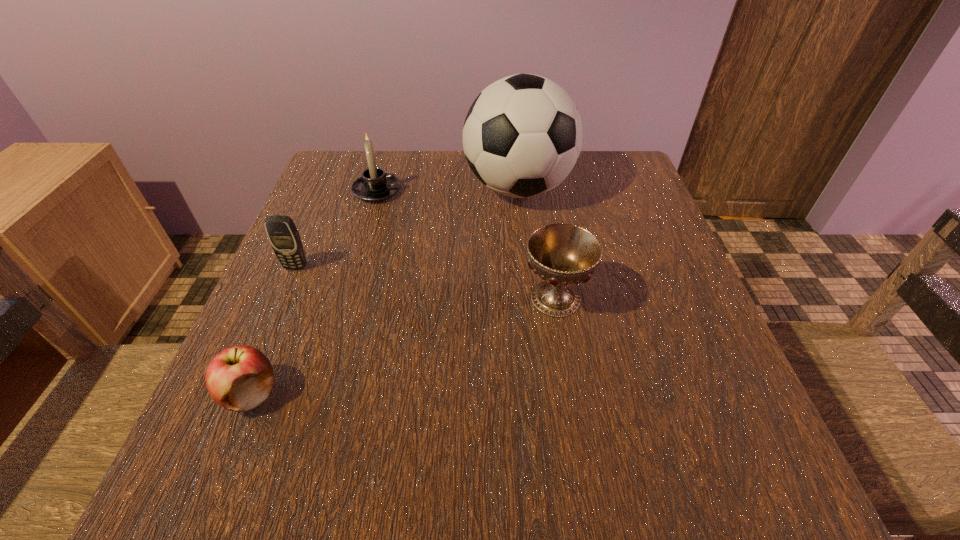
Identify the location of free space located 0.320m on the front face of the cellular telephone. This screenshot has height=540, width=960. (228, 424).

The width and height of the screenshot is (960, 540). I want to click on free location located 0.170m on the back of the shortest object, so click(x=293, y=292).

Locate an element on the screen. The width and height of the screenshot is (960, 540). soccer ball present at the far edge is located at coordinates (522, 136).

Identify the location of candle holder situated at the far edge. 374,185.

At what (x,y) coordinates should I click in order to perform the action: click on candle holder at the left edge. Please return your answer as a coordinate pair (x, y). The image size is (960, 540). Looking at the image, I should click on (374, 185).

Where is `cellular telephone situated at the left edge`? This screenshot has height=540, width=960. cellular telephone situated at the left edge is located at coordinates (283, 235).

Locate an element on the screen. This screenshot has width=960, height=540. apple present at the left edge is located at coordinates (240, 378).

Where is `object positioned at the far left corner`? object positioned at the far left corner is located at coordinates (374, 185).

The width and height of the screenshot is (960, 540). Identify the location of free point at the far edge. (457, 188).

This screenshot has height=540, width=960. In order to click on vacant space at the near edge of the desktop in this screenshot , I will do `click(610, 467)`.